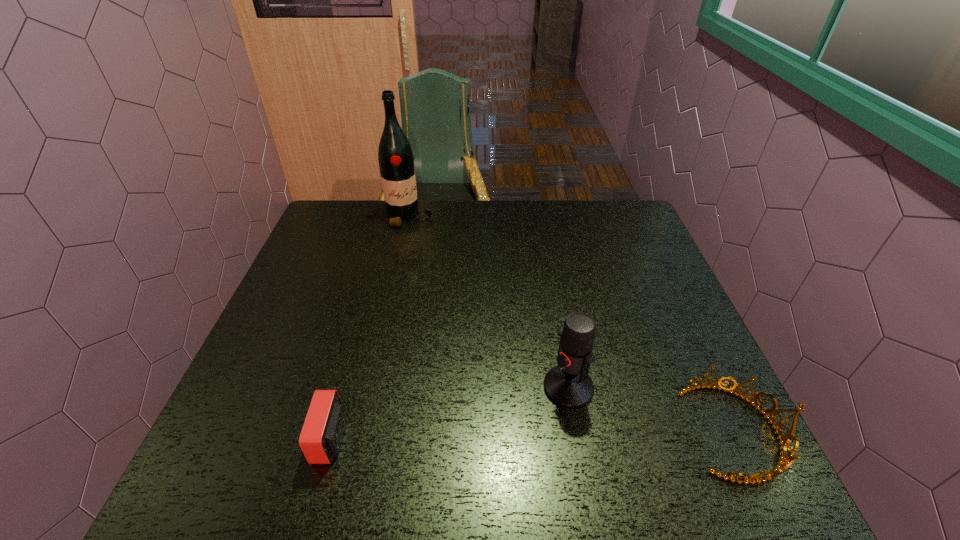
The width and height of the screenshot is (960, 540). Find the location of `object present at the near right corner`. object present at the near right corner is located at coordinates (784, 441).

At what (x,y) coordinates should I click in order to perform the action: click on free space at the far edge. Please return your answer as a coordinate pair (x, y). Looking at the image, I should click on (438, 235).

The width and height of the screenshot is (960, 540). I want to click on vacant space at the left edge, so click(x=263, y=377).

The height and width of the screenshot is (540, 960). I want to click on free space at the right edge of the desktop, so click(647, 320).

The width and height of the screenshot is (960, 540). I want to click on vacant space at the far left corner of the desktop, so click(x=338, y=203).

The width and height of the screenshot is (960, 540). In the image, there is a desktop. Identify the location of vacant region at the near left corner. (268, 424).

Find the location of a particular element. This screenshot has height=540, width=960. vacant space at the far right corner of the desktop is located at coordinates (608, 211).

At what (x,y) coordinates should I click in order to perform the action: click on empty space between the microphone and the alarm clock. Please return your answer as a coordinate pair (x, y). This screenshot has height=540, width=960. Looking at the image, I should click on (449, 413).

Find the location of a particular element. The width and height of the screenshot is (960, 540). free point between the tiara and the microphone is located at coordinates (653, 409).

What are the coordinates of `free space between the rightmost object and the alarm clock` in the screenshot? It's located at (535, 435).